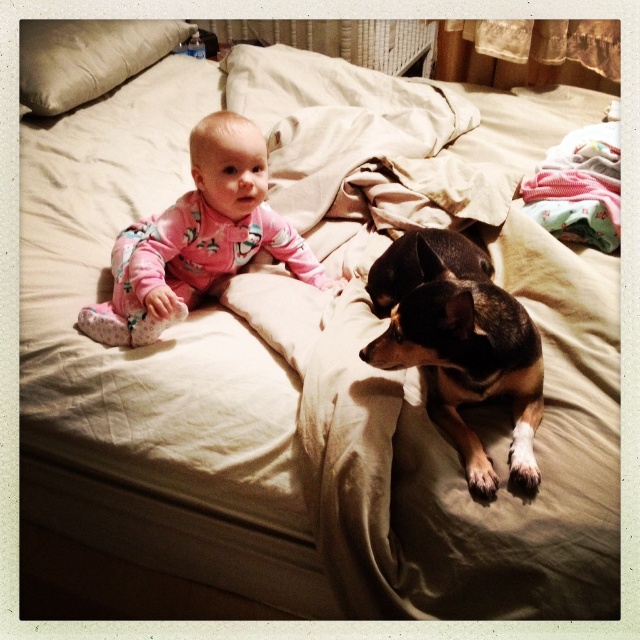
Based on the photo, how far apart are brown and black fur dog at center and beige fabric pillow at upper left?

4.50 feet

Is brown and black fur dog at center thinner than beige fabric pillow at upper left?

Indeed, brown and black fur dog at center has a lesser width compared to beige fabric pillow at upper left.

I want to click on brown and black fur dog at center, so click(458, 342).

How far apart are brown and black fur dog at center and pink fleece onesie at center?

brown and black fur dog at center and pink fleece onesie at center are 16.19 inches apart from each other.

Locate an element on the screen. This screenshot has height=640, width=640. brown and black fur dog at center is located at coordinates (458, 342).

Based on the photo, who is more distant from viewer, (266, 227) or (56, 72)?

The point (56, 72) is more distant.

Does pink fleece onesie at center have a smaller size compared to beige fabric pillow at upper left?

Yes.

Is point (243, 220) positioned behind point (58, 115)?

No, (243, 220) is closer to viewer.

The image size is (640, 640). I want to click on pink fleece onesie at center, so click(198, 237).